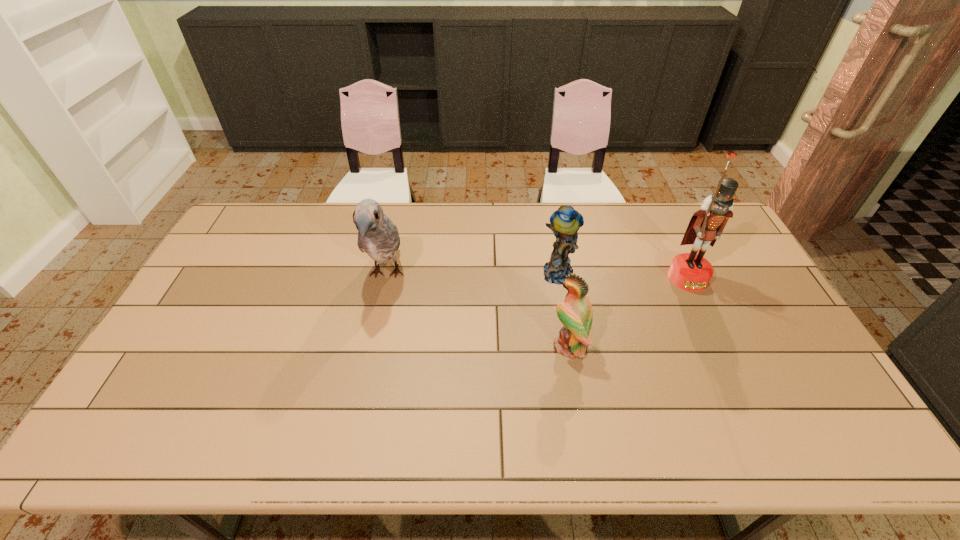
Identify which parrot is the closest to the leftmost parrot. Please provide its 2D coordinates. Your answer should be formatted as a tuple, i.e. [(x, y)], where the tuple contains the x and y coordinates of a point satisfying the conditions above.

[(565, 222)]

Locate an element on the screen. This screenshot has height=540, width=960. parrot identified as the closest to the leftmost object is located at coordinates (565, 222).

At what (x,y) coordinates should I click in order to perform the action: click on free spot that satisfies the following two spatial constraints: 1. on the front-facing side of the tallest object; 2. on the front-facing side of the nearest object. Please return your answer as a coordinate pair (x, y). The width and height of the screenshot is (960, 540). Looking at the image, I should click on (720, 346).

Find the location of a particular element. The width and height of the screenshot is (960, 540). vacant region that satisfies the following two spatial constraints: 1. on the front-facing side of the tallest object; 2. on the front-facing side of the nearest parrot is located at coordinates (720, 346).